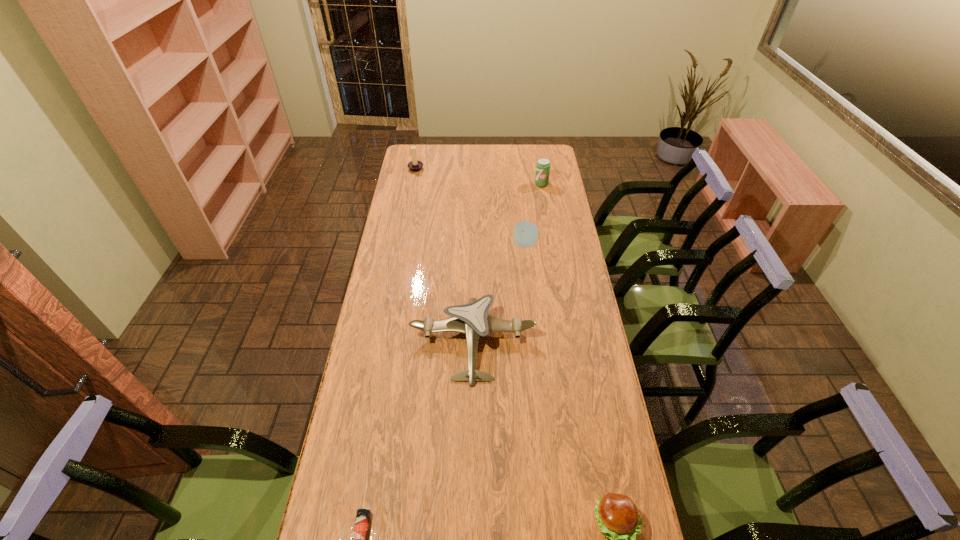
Select which object appears as the third closest to the fifth nearest object. Please provide its 2D coordinates. Your answer should be formatted as a tuple, i.e. [(x, y)], where the tuple contains the x and y coordinates of a point satisfying the conditions above.

[(472, 319)]

Identify which object is located as the fifth nearest to the fourth farthest object. Please provide its 2D coordinates. Your answer should be formatted as a tuple, i.e. [(x, y)], where the tuple contains the x and y coordinates of a point satisfying the conditions above.

[(415, 166)]

Locate an element on the screen. vacant space that satisfies the following two spatial constraints: 1. on the wick of the candle holder; 2. on the left side of the fifth nearest object is located at coordinates (413, 184).

This screenshot has width=960, height=540. What are the coordinates of `free point that satisfies the following two spatial constraints: 1. on the wick of the apple; 2. on the left side of the farthest object` in the screenshot? It's located at (402, 244).

What are the coordinates of `free location that satisfies the following two spatial constraints: 1. on the wick of the candle holder; 2. on the right side of the fourth nearest object` in the screenshot? It's located at (402, 244).